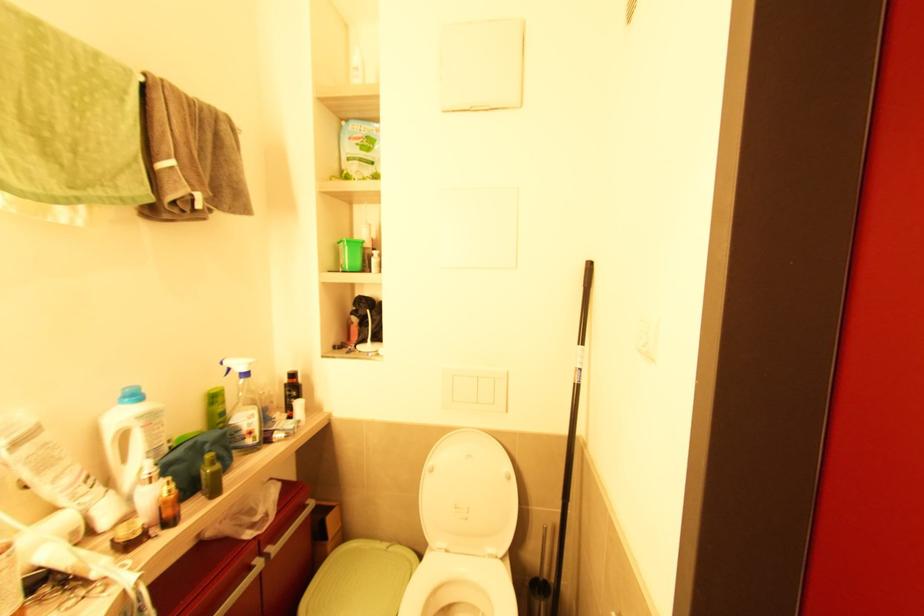
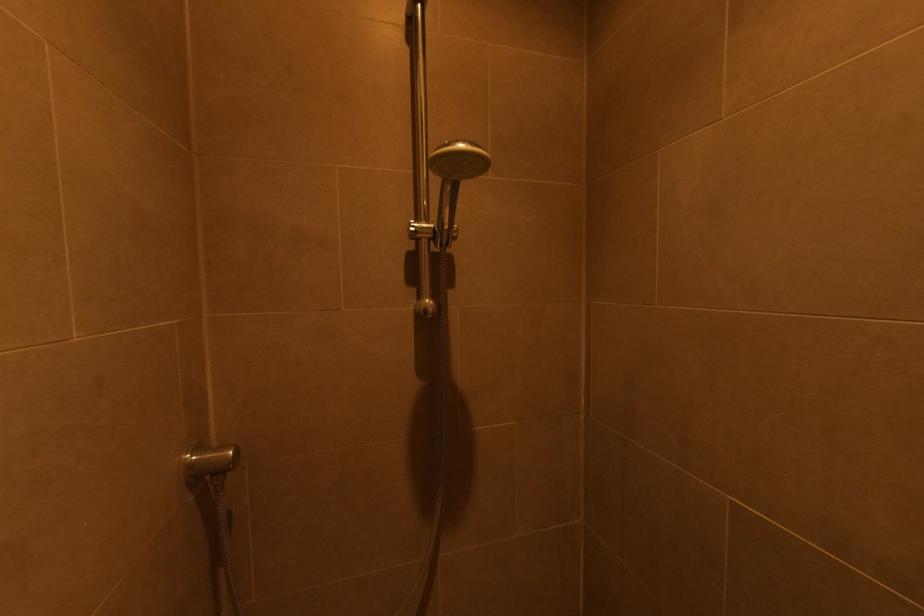
Question: The first image is from the beginning of the video and the second image is from the end. How did the camera likely rotate when shooting the video?

Choices:
 (A) Left
 (B) Right
 (C) Up
 (D) Down

Answer: (A)